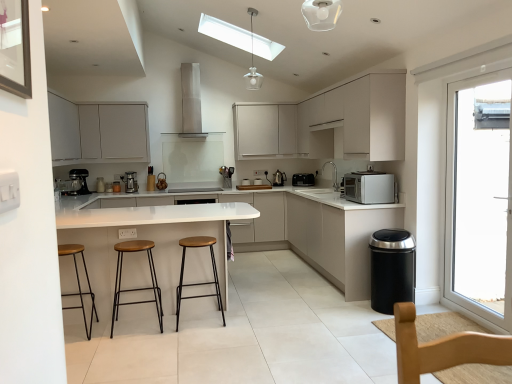
Measure the distance between point (190,246) and camera.

Point (190,246) and camera are 3.74 meters apart from each other.

Where is `wooden seat stool at center, the first stool when ordered from right to left`? The height and width of the screenshot is (384, 512). wooden seat stool at center, the first stool when ordered from right to left is located at coordinates (198, 283).

What do you see at coordinates (338, 238) in the screenshot? The image size is (512, 384). I see `satin white microwave at right, arranged as the fifth cabinetry when viewed from the left` at bounding box center [338, 238].

The image size is (512, 384). What do you see at coordinates (98, 131) in the screenshot?
I see `matte white cabinets at upper left, which is counted as the fourth cabinetry, starting from the right` at bounding box center [98, 131].

Where is `clear glass pendant light at upper center`? clear glass pendant light at upper center is located at coordinates (253, 62).

This screenshot has height=384, width=512. Describe the element at coordinates (279, 178) in the screenshot. I see `polished stainless steel kettle at center-right, the 1th appliance from the left` at that location.

Locate an element on the screen. This screenshot has width=512, height=384. wooden seat stool at center, placed as the 2th stool when sorted from right to left is located at coordinates (136, 288).

The image size is (512, 384). What do you see at coordinates (79, 283) in the screenshot?
I see `wooden seat metal frame stool at left, which is the 1th stool from left to right` at bounding box center [79, 283].

What do you see at coordinates (146, 239) in the screenshot? The image size is (512, 384). I see `white glossy table at center` at bounding box center [146, 239].

Image resolution: width=512 pixels, height=384 pixels. I want to click on wooden seat stool at center, the first stool when ordered from right to left, so click(x=198, y=283).

Would you say white glossy countertop at center is a long distance from transparent glass door at right?

Indeed, white glossy countertop at center is not near transparent glass door at right.

Does white glossy countertop at center have a smaller size compared to transparent glass door at right?

Incorrect, white glossy countertop at center is not smaller in size than transparent glass door at right.

Is transparent glass door at right surrounded by white glossy countertop at center?

No, transparent glass door at right is not surrounded by white glossy countertop at center.

You are a GUI agent. You are given a task and a screenshot of the screen. Output one action in this format:
    pyautogui.click(x=<x>, y=<y>)
    Task: Click on the glass door in front of the white glossy countertop at center
    
    Given the screenshot: What is the action you would take?
    pyautogui.click(x=478, y=196)

Which is in front, wooden seat metal frame stool at left, which is the 1th stool from left to right, or satin white microwave at right, arranged as the fifth cabinetry when viewed from the left?

Positioned in front is wooden seat metal frame stool at left, which is the 1th stool from left to right.

Is wooden seat metal frame stool at left, which is the third stool in right-to-left order, positioned with its back to satin white microwave at right, arranged as the fifth cabinetry when viewed from the left?

wooden seat metal frame stool at left, which is the third stool in right-to-left order, does not have its back to satin white microwave at right, arranged as the fifth cabinetry when viewed from the left.

Does white matte cabinet at upper center, the second cabinetry from the right, turn towards white glossy table at center?

No, white matte cabinet at upper center, the second cabinetry from the right, is not turned towards white glossy table at center.

Does white matte cabinet at upper center, the second cabinetry from the right, appear on the right side of white glossy table at center?

Correct, you'll find white matte cabinet at upper center, the second cabinetry from the right, to the right of white glossy table at center.

Considering the positions of objects white matte cabinet at upper center, marked as the fourth cabinetry in a left-to-right arrangement, and white glossy table at center in the image provided, who is in front, white matte cabinet at upper center, marked as the fourth cabinetry in a left-to-right arrangement, or white glossy table at center?

white glossy table at center is more forward.

Considering the relative sizes of white matte cabinet at upper center, marked as the fourth cabinetry in a left-to-right arrangement, and white glossy table at center in the image provided, is white matte cabinet at upper center, marked as the fourth cabinetry in a left-to-right arrangement, shorter than white glossy table at center?

Correct, white matte cabinet at upper center, marked as the fourth cabinetry in a left-to-right arrangement, is not as tall as white glossy table at center.

Is matte white cabinets at upper left, which is counted as the fourth cabinetry, starting from the right, facing towards transparent glass door at right?

Yes, matte white cabinets at upper left, which is counted as the fourth cabinetry, starting from the right, faces towards transparent glass door at right.

How different are the orientations of matte white cabinets at upper left, the second cabinetry in the left-to-right sequence, and transparent glass door at right in degrees?

The facing directions of matte white cabinets at upper left, the second cabinetry in the left-to-right sequence, and transparent glass door at right are 180 degrees apart.

From a real-world perspective, which object rests below the other?

transparent glass door at right.

Looking at this image, does matte white cabinets at upper left, the second cabinetry in the left-to-right sequence, have a lesser width compared to transparent glass door at right?

Incorrect, the width of matte white cabinets at upper left, the second cabinetry in the left-to-right sequence, is not less than that of transparent glass door at right.

Is matte white cabinet at upper center, which appears as the 3th cabinetry when viewed from the left, aimed at white matte microwave at right?

Yes, matte white cabinet at upper center, which appears as the 3th cabinetry when viewed from the left, is aimed at white matte microwave at right.

Looking at this image, is matte white cabinet at upper center, the 3th cabinetry from the right, to the right of white matte microwave at right from the viewer's perspective?

No.

Considering the relative sizes of matte white cabinet at upper center, which appears as the 3th cabinetry when viewed from the left, and white matte microwave at right in the image provided, is matte white cabinet at upper center, which appears as the 3th cabinetry when viewed from the left, smaller than white matte microwave at right?

No, matte white cabinet at upper center, which appears as the 3th cabinetry when viewed from the left, is not smaller than white matte microwave at right.

Is matte white cabinet at upper center, which appears as the 3th cabinetry when viewed from the left, not near white matte microwave at right?

Yes, matte white cabinet at upper center, which appears as the 3th cabinetry when viewed from the left, is far from white matte microwave at right.

Is transparent glass door at right facing towards matte white cabinets at upper left, the second cabinetry in the left-to-right sequence?

No.

Considering the positions of objects transparent glass door at right and matte white cabinets at upper left, which is counted as the fourth cabinetry, starting from the right, in the image provided, who is more to the left, transparent glass door at right or matte white cabinets at upper left, which is counted as the fourth cabinetry, starting from the right,?

Positioned to the left is matte white cabinets at upper left, which is counted as the fourth cabinetry, starting from the right.

Would you consider transparent glass door at right to be distant from matte white cabinets at upper left, which is counted as the fourth cabinetry, starting from the right?

Yes, transparent glass door at right and matte white cabinets at upper left, which is counted as the fourth cabinetry, starting from the right, are quite far apart.

From the image's perspective, relative to matte white cabinets at upper left, the second cabinetry in the left-to-right sequence, is transparent glass door at right above or below?

Based on their image positions, transparent glass door at right is located beneath matte white cabinets at upper left, the second cabinetry in the left-to-right sequence.

Which point is more distant from viewer, (282, 184) or (298, 185)?

The point (282, 184) is farther from the camera.

Is polished stainless steel kettle at center-right, the second appliance from the right, not close to satin silver toaster at center, acting as the 1th appliance starting from the right?

Actually, polished stainless steel kettle at center-right, the second appliance from the right, and satin silver toaster at center, acting as the 1th appliance starting from the right, are a little close together.

Image resolution: width=512 pixels, height=384 pixels. In order to click on appliance that is in front of the polished stainless steel kettle at center-right, the 1th appliance from the left in this screenshot , I will do `click(303, 179)`.

Which object is further away from the camera, polished stainless steel kettle at center-right, the 1th appliance from the left, or satin silver toaster at center, acting as the 1th appliance starting from the right?

Positioned behind is polished stainless steel kettle at center-right, the 1th appliance from the left.

The image size is (512, 384). What are the coordinates of `countertop that appears on the left of transparent glass door at right` in the screenshot? It's located at (319, 232).

Where is `stool that is the 3rd object located in front of the satin white microwave at right, the first cabinetry positioned from the right`? The image size is (512, 384). stool that is the 3rd object located in front of the satin white microwave at right, the first cabinetry positioned from the right is located at coordinates (79, 283).

Estimate the real-world distances between objects in this image. Which object is closer to satin black coffee machine at center, which appears as the first coffee machine when viewed from the right, white glossy table at center or black matte trash can at lower right?

The object closer to satin black coffee machine at center, which appears as the first coffee machine when viewed from the right, is white glossy table at center.

Which object lies nearer to the anchor point wooden seat metal frame stool at left, which is the 1th stool from left to right, metallic silver coffee machine at left, which is the second coffee machine from right to left, or white matte microwave at right?

The object closer to wooden seat metal frame stool at left, which is the 1th stool from left to right, is metallic silver coffee machine at left, which is the second coffee machine from right to left.

Based on their spatial positions, is metallic silver coffee machine at left, which appears as the first coffee machine when viewed from the left, or black matte trash can at lower right closer to wooden seat stool at center, the first stool when ordered from right to left?

black matte trash can at lower right is positioned closer to the anchor wooden seat stool at center, the first stool when ordered from right to left.

Looking at the image, which one is located further to satin white microwave at right, arranged as the fifth cabinetry when viewed from the left, stainless steel range hood at upper center or clear glass pendant light at upper center?

The object further to satin white microwave at right, arranged as the fifth cabinetry when viewed from the left, is clear glass pendant light at upper center.

When comparing their distances from wooden seat stool at center, placed as the 2th stool when sorted from left to right, does transparent glass door at right or clear glass pendant light at upper center seem closer?

Based on the image, transparent glass door at right appears to be nearer to wooden seat stool at center, placed as the 2th stool when sorted from left to right.

Estimate the real-world distances between objects in this image. Which object is further from white glossy table at center, metallic silver coffee machine at left, which appears as the first coffee machine when viewed from the left, or wooden seat metal frame stool at left, which is the third stool in right-to-left order?

Among the two, metallic silver coffee machine at left, which appears as the first coffee machine when viewed from the left, is located further to white glossy table at center.

From the picture: When comparing their distances from wooden seat stool at center, placed as the 2th stool when sorted from left to right, does stainless steel range hood at upper center or transparent glass door at right seem further?

stainless steel range hood at upper center is positioned further to the anchor wooden seat stool at center, placed as the 2th stool when sorted from left to right.

Considering their positions, is stainless steel range hood at upper center positioned further to matte white cabinet at upper center, which appears as the 3th cabinetry when viewed from the left, than metallic silver coffee machine at left, which is the second coffee machine from right to left?

Based on the image, metallic silver coffee machine at left, which is the second coffee machine from right to left, appears to be further to matte white cabinet at upper center, which appears as the 3th cabinetry when viewed from the left.

Where is `dish washer between transparent glass door at right and satin silver toaster at center, acting as the 1th appliance starting from the right, from front to back`? The width and height of the screenshot is (512, 384). dish washer between transparent glass door at right and satin silver toaster at center, acting as the 1th appliance starting from the right, from front to back is located at coordinates (392, 269).

Where is `stool between wooden seat metal frame stool at left, which is the 1th stool from left to right, and wooden seat stool at center, arranged as the 3th stool when viewed from the left, in the horizontal direction`? stool between wooden seat metal frame stool at left, which is the 1th stool from left to right, and wooden seat stool at center, arranged as the 3th stool when viewed from the left, in the horizontal direction is located at coordinates (136, 288).

Where is `table between satin black coffee machine at center, which appears as the first coffee machine when viewed from the right, and transparent glass door at right from left to right`? This screenshot has height=384, width=512. table between satin black coffee machine at center, which appears as the first coffee machine when viewed from the right, and transparent glass door at right from left to right is located at coordinates (146, 239).

What are the coordinates of `countertop between matte white cabinets at upper left, which is counted as the fourth cabinetry, starting from the right, and wooden seat stool at center, placed as the 2th stool when sorted from right to left, in the up-down direction` in the screenshot? It's located at (319, 232).